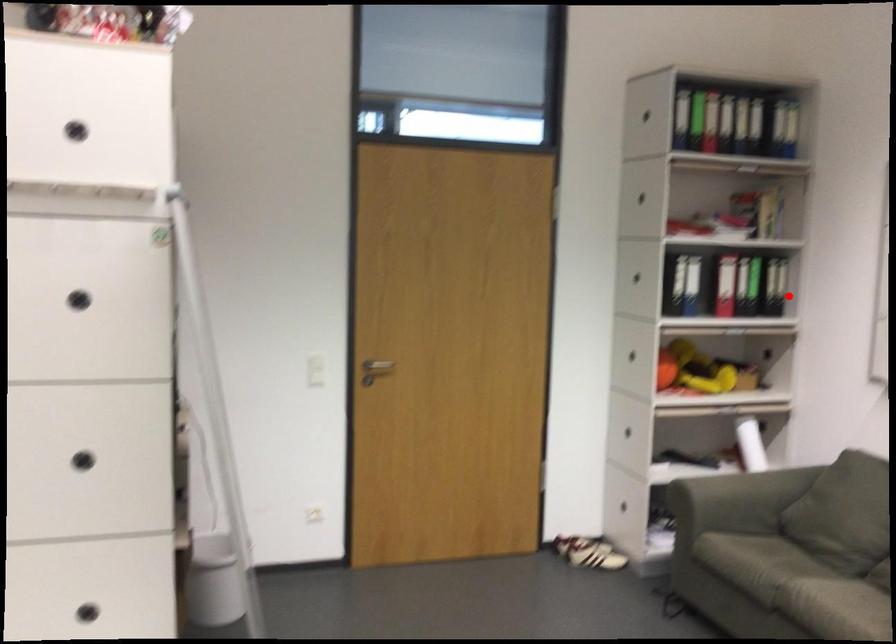
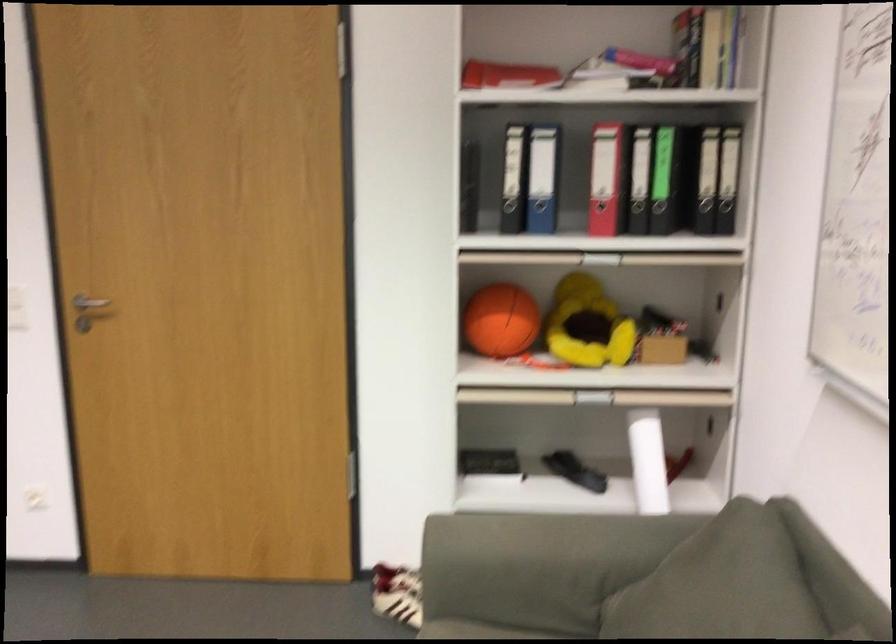
Where in the second image is the point corresponding to the highlighted location from the first image?

(734, 214)